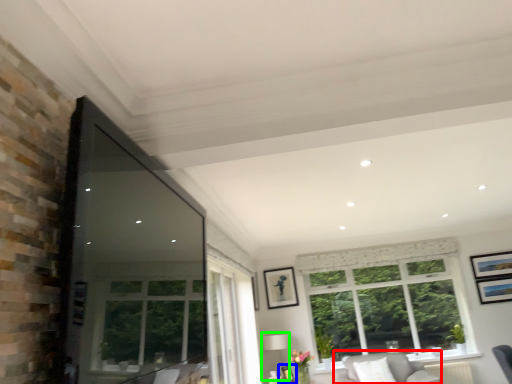
Question: Which is farther away from couch (highlighted by a red box)? picture frame (highlighted by a blue box) or lamp (highlighted by a green box)?

Choices:
 (A) picture frame
 (B) lamp

Answer: (B)